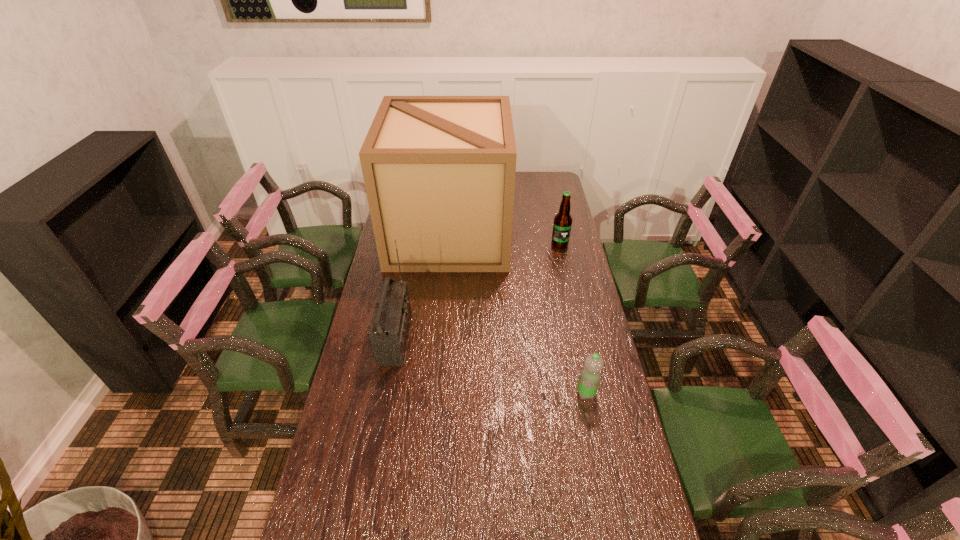
Image resolution: width=960 pixels, height=540 pixels. I want to click on free point between the box and the shortest object, so click(517, 314).

The image size is (960, 540). In order to click on blank region between the third tallest object and the nearest object in this screenshot , I will do `click(573, 319)`.

Image resolution: width=960 pixels, height=540 pixels. In order to click on object that is the third closest one to the tallest object in this screenshot , I will do [x=590, y=375].

Identify which object is the third closest to the third tallest object. Please provide its 2D coordinates. Your answer should be formatted as a tuple, i.e. [(x, y)], where the tuple contains the x and y coordinates of a point satisfying the conditions above.

[(590, 375)]

This screenshot has height=540, width=960. Find the location of `vacant space that satisfies the following two spatial constraints: 1. on the reinforced sides of the box; 2. on the right side of the water bottle`. vacant space that satisfies the following two spatial constraints: 1. on the reinforced sides of the box; 2. on the right side of the water bottle is located at coordinates 435,393.

Find the location of a particular element. This screenshot has width=960, height=540. vacant position in the image that satisfies the following two spatial constraints: 1. on the reinforced sides of the tallest object; 2. on the back side of the shortest object is located at coordinates (435, 393).

Identify the location of free region that satisfies the following two spatial constraints: 1. on the front panel of the shortest object; 2. on the right side of the second tallest object. The image size is (960, 540). (386, 393).